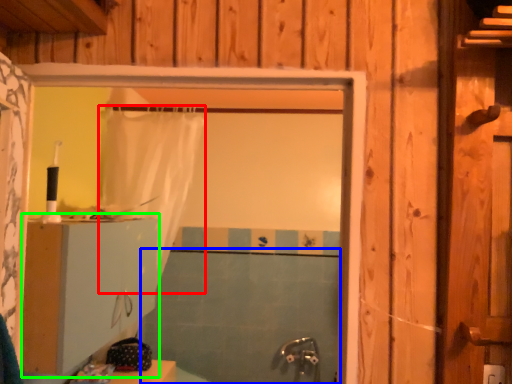
Question: Which is farther away from shower curtain (highlighted by a red box)? bath (highlighted by a blue box) or dresser (highlighted by a green box)?

Choices:
 (A) bath
 (B) dresser

Answer: (A)